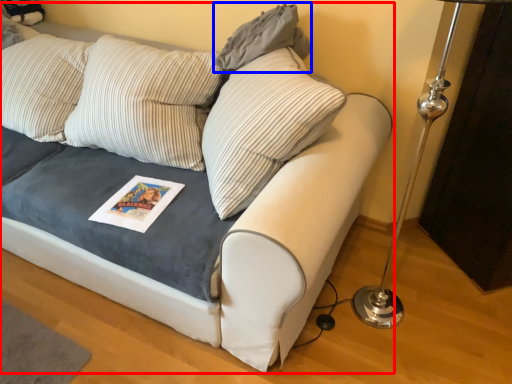
Question: Which point is further to the camera, studio couch (highlighted by a red box) or pillow (highlighted by a blue box)?

Choices:
 (A) studio couch
 (B) pillow

Answer: (B)